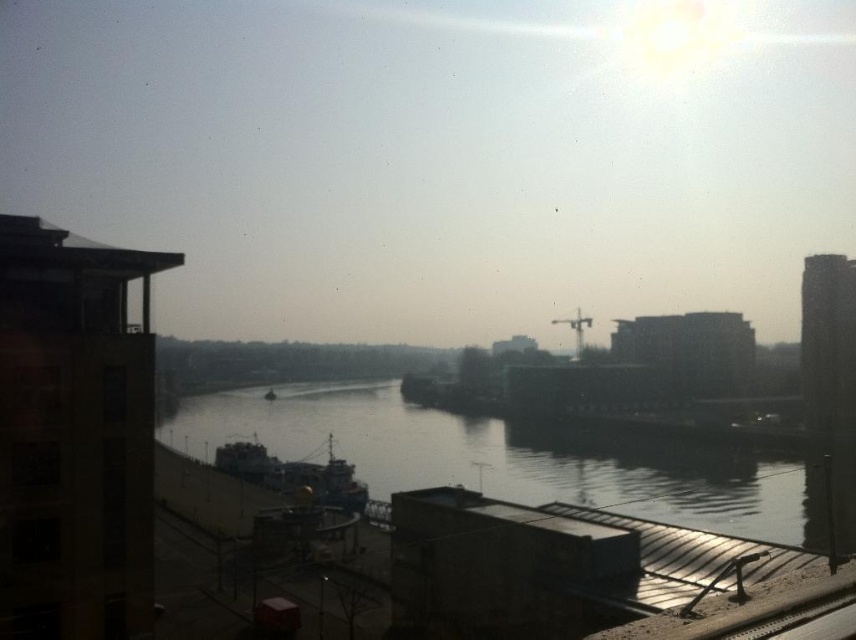
Is smooth concrete river at center smaller than dark blue metallic ship at center?

Incorrect, smooth concrete river at center is not smaller in size than dark blue metallic ship at center.

Who is lower down, smooth concrete river at center or dark blue metallic ship at center?

dark blue metallic ship at center is lower down.

Is point (348, 422) closer to viewer compared to point (366, 486)?

No, (348, 422) is further to viewer.

Where is `smooth concrete river at center`? The image size is (856, 640). smooth concrete river at center is located at coordinates (515, 458).